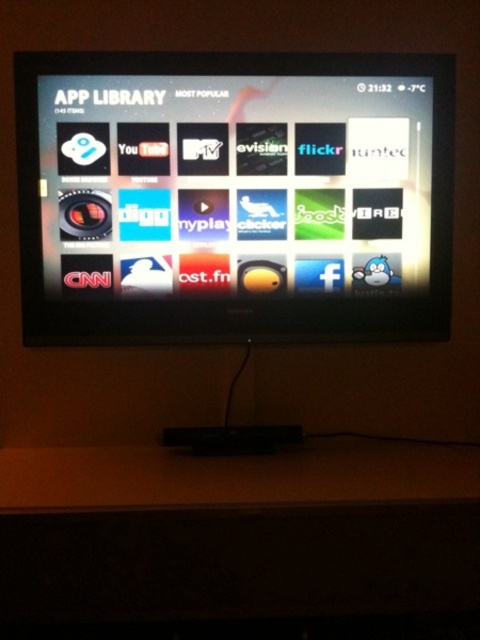
Is black glossy tv at center below wooden table at lower center?

No, black glossy tv at center is not below wooden table at lower center.

Is point (346, 72) positioned after point (249, 579)?

Yes, point (346, 72) is behind point (249, 579).

The image size is (480, 640). Find the location of `black glossy tv at center`. black glossy tv at center is located at coordinates (233, 196).